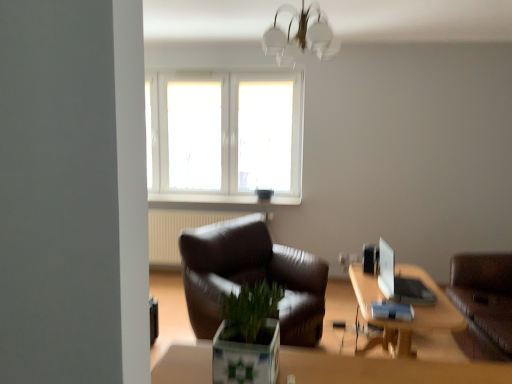
Question: Considering the relative sizes of brown leather couch at right and green matte plant at center in the image provided, is brown leather couch at right wider than green matte plant at center?

Choices:
 (A) no
 (B) yes

Answer: (B)

Question: From the image's perspective, is brown leather couch at right over green matte plant at center?

Choices:
 (A) yes
 (B) no

Answer: (B)

Question: Is brown leather couch at right not near green matte plant at center?

Choices:
 (A) yes
 (B) no

Answer: (A)

Question: Does brown leather couch at right have a lesser width compared to green matte plant at center?

Choices:
 (A) no
 (B) yes

Answer: (A)

Question: Is brown leather couch at right positioned with its back to green matte plant at center?

Choices:
 (A) no
 (B) yes

Answer: (A)

Question: Is point (243, 297) closer or farther from the camera than point (202, 114)?

Choices:
 (A) farther
 (B) closer

Answer: (B)

Question: Is green matte plant at center taller or shorter than white plastic window at upper center?

Choices:
 (A) short
 (B) tall

Answer: (A)

Question: Is green matte plant at center in front of or behind white plastic window at upper center in the image?

Choices:
 (A) behind
 (B) front

Answer: (B)

Question: Based on their sizes in the image, would you say green matte plant at center is bigger or smaller than white plastic window at upper center?

Choices:
 (A) big
 (B) small

Answer: (B)

Question: In terms of width, does brown leather couch at right look wider or thinner when compared to green matte plant at center?

Choices:
 (A) wide
 (B) thin

Answer: (A)

Question: Considering the positions of point (462, 256) and point (228, 321), is point (462, 256) closer or farther from the camera than point (228, 321)?

Choices:
 (A) farther
 (B) closer

Answer: (A)

Question: Relative to green matte plant at center, is brown leather couch at right in front or behind?

Choices:
 (A) behind
 (B) front

Answer: (A)

Question: Is brown leather couch at right situated inside green matte plant at center or outside?

Choices:
 (A) outside
 (B) inside

Answer: (A)

Question: Looking at the image, does wooden table at lower right seem bigger or smaller compared to green matte plant at center?

Choices:
 (A) small
 (B) big

Answer: (B)

Question: From a real-world perspective, is wooden table at lower right above or below green matte plant at center?

Choices:
 (A) above
 (B) below

Answer: (B)